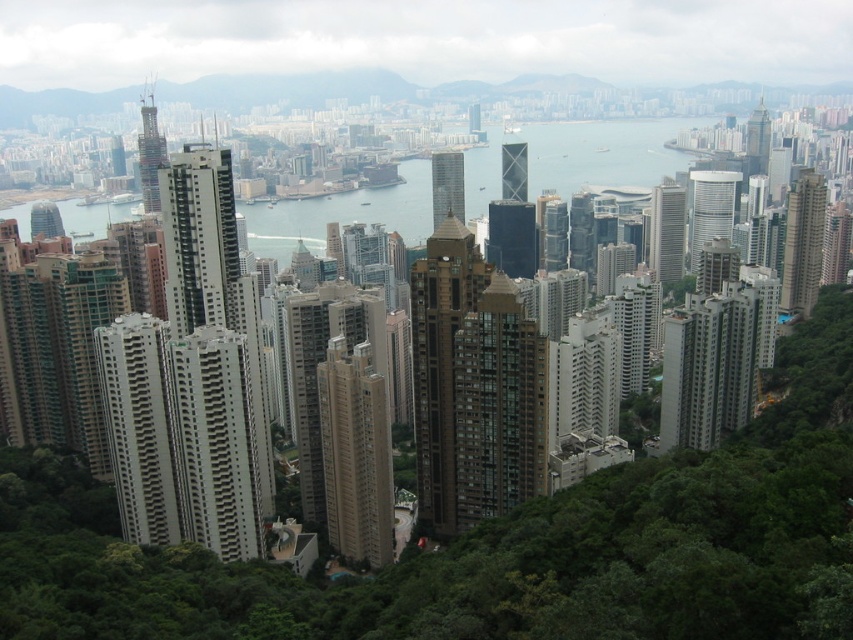
You are standing at the point marked as point (x=355, y=454) in the image. Looking around, you see the beige concrete building at center. Based on your location, which direction is the beige concrete building at center located relative to you?

The beige concrete building at center is located in the center direction from your current position at point (x=355, y=454).